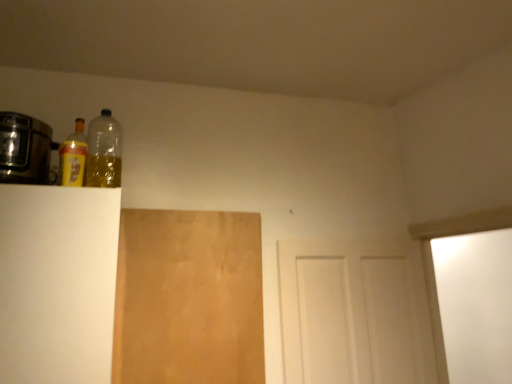
Measure the distance between metallic silver toaster at left and camera.

1.35 meters.

Describe the element at coordinates (104, 152) in the screenshot. The image size is (512, 384). I see `transparent plastic bottle at upper left, which appears as the first bottle when viewed from the right` at that location.

What do you see at coordinates (188, 298) in the screenshot? I see `brown matte plywood at center-left` at bounding box center [188, 298].

What do you see at coordinates (354, 313) in the screenshot? The image size is (512, 384). I see `white matte door at center` at bounding box center [354, 313].

Measure the distance between white matte cabinet at left and camera.

They are 1.22 meters apart.

You are a GUI agent. You are given a task and a screenshot of the screen. Output one action in this format:
    pyautogui.click(x=<x>, y=<y>)
    Task: Click on the yellow matte bottle at upper left, marked as the 2th bottle in a right-to-left arrangement
    This screenshot has height=384, width=512.
    Given the screenshot: What is the action you would take?
    pyautogui.click(x=73, y=156)

Measure the distance between white matte door at center and transparent plastic bottle at upper left, placed as the 2th bottle when sorted from left to right.

white matte door at center is 4.08 feet away from transparent plastic bottle at upper left, placed as the 2th bottle when sorted from left to right.

Is white matte door at center in contact with transparent plastic bottle at upper left, which appears as the first bottle when viewed from the right?

They are not placed beside each other.

Who is more distant, white matte door at center or transparent plastic bottle at upper left, which appears as the first bottle when viewed from the right?

white matte door at center is behind.

Considering the sizes of white matte door at center and transparent plastic bottle at upper left, placed as the 2th bottle when sorted from left to right, in the image, is white matte door at center wider or thinner than transparent plastic bottle at upper left, placed as the 2th bottle when sorted from left to right,?

Considering their sizes, white matte door at center looks broader than transparent plastic bottle at upper left, placed as the 2th bottle when sorted from left to right.

Is white matte door at center bigger than white matte cabinet at left?

Actually, white matte door at center might be smaller than white matte cabinet at left.

Can you confirm if white matte door at center is thinner than white matte cabinet at left?

Yes.

From a real-world perspective, is white matte door at center below white matte cabinet at left?

Indeed, from a real-world perspective, white matte door at center is positioned beneath white matte cabinet at left.

Considering the positions of objects metallic silver toaster at left and white matte cabinet at left in the image provided, who is more to the left, metallic silver toaster at left or white matte cabinet at left?

metallic silver toaster at left.

Between metallic silver toaster at left and white matte cabinet at left, which one has larger width?

Wider between the two is white matte cabinet at left.

Considering the sizes of objects metallic silver toaster at left and white matte cabinet at left in the image provided, who is shorter, metallic silver toaster at left or white matte cabinet at left?

Standing shorter between the two is metallic silver toaster at left.

Considering the sizes of objects metallic silver toaster at left and white matte cabinet at left in the image provided, who is smaller, metallic silver toaster at left or white matte cabinet at left?

Smaller between the two is metallic silver toaster at left.

Is transparent plastic bottle at upper left, which appears as the first bottle when viewed from the right, in front of yellow matte bottle at upper left, marked as the 2th bottle in a right-to-left arrangement?

Yes, it is in front of yellow matte bottle at upper left, marked as the 2th bottle in a right-to-left arrangement.

From the image's perspective, which is below, transparent plastic bottle at upper left, placed as the 2th bottle when sorted from left to right, or yellow matte bottle at upper left, marked as the 2th bottle in a right-to-left arrangement?

yellow matte bottle at upper left, marked as the 2th bottle in a right-to-left arrangement, is shown below in the image.

Considering the relative positions of transparent plastic bottle at upper left, placed as the 2th bottle when sorted from left to right, and yellow matte bottle at upper left, which is counted as the 1th bottle, starting from the left, in the image provided, is transparent plastic bottle at upper left, placed as the 2th bottle when sorted from left to right, to the left of yellow matte bottle at upper left, which is counted as the 1th bottle, starting from the left, from the viewer's perspective?

No, transparent plastic bottle at upper left, placed as the 2th bottle when sorted from left to right, is not to the left of yellow matte bottle at upper left, which is counted as the 1th bottle, starting from the left.

From a real-world perspective, which is physically below, transparent plastic bottle at upper left, which appears as the first bottle when viewed from the right, or yellow matte bottle at upper left, marked as the 2th bottle in a right-to-left arrangement?

yellow matte bottle at upper left, marked as the 2th bottle in a right-to-left arrangement, from a real-world perspective.

From the image's perspective, who appears lower, transparent plastic bottle at upper left, placed as the 2th bottle when sorted from left to right, or white matte door at center?

From the image's view, white matte door at center is below.

Is transparent plastic bottle at upper left, which appears as the first bottle when viewed from the right, positioned with its back to white matte door at center?

No, white matte door at center is not at the back of transparent plastic bottle at upper left, which appears as the first bottle when viewed from the right.

Which of these two, transparent plastic bottle at upper left, placed as the 2th bottle when sorted from left to right, or white matte door at center, is bigger?

white matte door at center.

Considering the sizes of objects transparent plastic bottle at upper left, placed as the 2th bottle when sorted from left to right, and white matte door at center in the image provided, who is shorter, transparent plastic bottle at upper left, placed as the 2th bottle when sorted from left to right, or white matte door at center?

Standing shorter between the two is transparent plastic bottle at upper left, placed as the 2th bottle when sorted from left to right.

Can you confirm if yellow matte bottle at upper left, which is counted as the 1th bottle, starting from the left, is positioned to the left of white matte cabinet at left?

No.

Considering the relative sizes of yellow matte bottle at upper left, marked as the 2th bottle in a right-to-left arrangement, and white matte cabinet at left in the image provided, is yellow matte bottle at upper left, marked as the 2th bottle in a right-to-left arrangement, smaller than white matte cabinet at left?

Indeed, yellow matte bottle at upper left, marked as the 2th bottle in a right-to-left arrangement, has a smaller size compared to white matte cabinet at left.

Do you think yellow matte bottle at upper left, which is counted as the 1th bottle, starting from the left, is within white matte cabinet at left, or outside of it?

yellow matte bottle at upper left, which is counted as the 1th bottle, starting from the left, is not inside white matte cabinet at left, it's outside.

Is yellow matte bottle at upper left, marked as the 2th bottle in a right-to-left arrangement, thinner than white matte cabinet at left?

Yes.

Is metallic silver toaster at left facing away from transparent plastic bottle at upper left, which appears as the first bottle when viewed from the right?

No, transparent plastic bottle at upper left, which appears as the first bottle when viewed from the right, is not at the back of metallic silver toaster at left.

Consider the image. Is metallic silver toaster at left placed right next to transparent plastic bottle at upper left, placed as the 2th bottle when sorted from left to right?

There is a gap between metallic silver toaster at left and transparent plastic bottle at upper left, placed as the 2th bottle when sorted from left to right.

In the scene shown: Can you confirm if metallic silver toaster at left is thinner than transparent plastic bottle at upper left, placed as the 2th bottle when sorted from left to right?

Incorrect, the width of metallic silver toaster at left is not less than that of transparent plastic bottle at upper left, placed as the 2th bottle when sorted from left to right.

Locate an element on the screen. The width and height of the screenshot is (512, 384). door below the transparent plastic bottle at upper left, which appears as the first bottle when viewed from the right (from a real-world perspective) is located at coordinates (354, 313).

Find the location of a particular element. door below the white matte cabinet at left (from the image's perspective) is located at coordinates (354, 313).

Based on the photo, when comparing their distances from white matte cabinet at left, does brown matte plywood at center-left or transparent plastic bottle at upper left, placed as the 2th bottle when sorted from left to right, seem further?

transparent plastic bottle at upper left, placed as the 2th bottle when sorted from left to right, is further to white matte cabinet at left.

When comparing their distances from metallic silver toaster at left, does brown matte plywood at center-left or transparent plastic bottle at upper left, which appears as the first bottle when viewed from the right, seem closer?

transparent plastic bottle at upper left, which appears as the first bottle when viewed from the right.

From the image, which object appears to be nearer to metallic silver toaster at left, white matte cabinet at left or brown matte plywood at center-left?

white matte cabinet at left.

When comparing their distances from white matte cabinet at left, does transparent plastic bottle at upper left, placed as the 2th bottle when sorted from left to right, or white matte door at center seem closer?

The object closer to white matte cabinet at left is transparent plastic bottle at upper left, placed as the 2th bottle when sorted from left to right.

From the image, which object appears to be nearer to white matte cabinet at left, white matte door at center or metallic silver toaster at left?

metallic silver toaster at left is closer to white matte cabinet at left.

Looking at the image, which one is located further to white matte cabinet at left, transparent plastic bottle at upper left, which appears as the first bottle when viewed from the right, or metallic silver toaster at left?

transparent plastic bottle at upper left, which appears as the first bottle when viewed from the right, is positioned further to the anchor white matte cabinet at left.

Based on their spatial positions, is white matte door at center or metallic silver toaster at left closer to yellow matte bottle at upper left, which is counted as the 1th bottle, starting from the left?

Based on the image, metallic silver toaster at left appears to be nearer to yellow matte bottle at upper left, which is counted as the 1th bottle, starting from the left.

When comparing their distances from white matte cabinet at left, does brown matte plywood at center-left or yellow matte bottle at upper left, marked as the 2th bottle in a right-to-left arrangement, seem closer?

yellow matte bottle at upper left, marked as the 2th bottle in a right-to-left arrangement, is closer to white matte cabinet at left.

Where is `bottle between metallic silver toaster at left and brown matte plywood at center-left vertically`? bottle between metallic silver toaster at left and brown matte plywood at center-left vertically is located at coordinates (73, 156).

Find the location of a particular element. The width and height of the screenshot is (512, 384). bottle located between metallic silver toaster at left and transparent plastic bottle at upper left, placed as the 2th bottle when sorted from left to right, in the left-right direction is located at coordinates (73, 156).

I want to click on cabinetry between metallic silver toaster at left and brown matte plywood at center-left, so click(x=57, y=283).

Locate an element on the screen. The image size is (512, 384). cabinetry between transparent plastic bottle at upper left, placed as the 2th bottle when sorted from left to right, and brown matte plywood at center-left in the up-down direction is located at coordinates (57, 283).